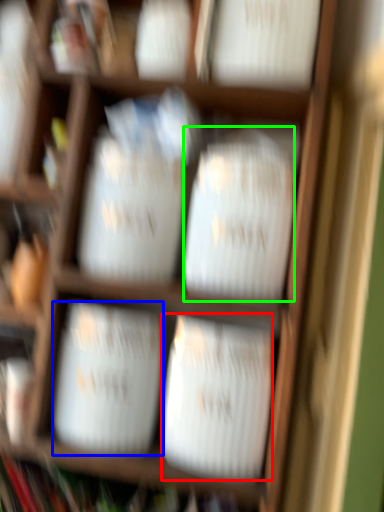
Question: Which object is positioned farthest from wide (highlighted by a red box)? Select from wide (highlighted by a blue box) and wide (highlighted by a green box).

Choices:
 (A) wide
 (B) wide

Answer: (B)